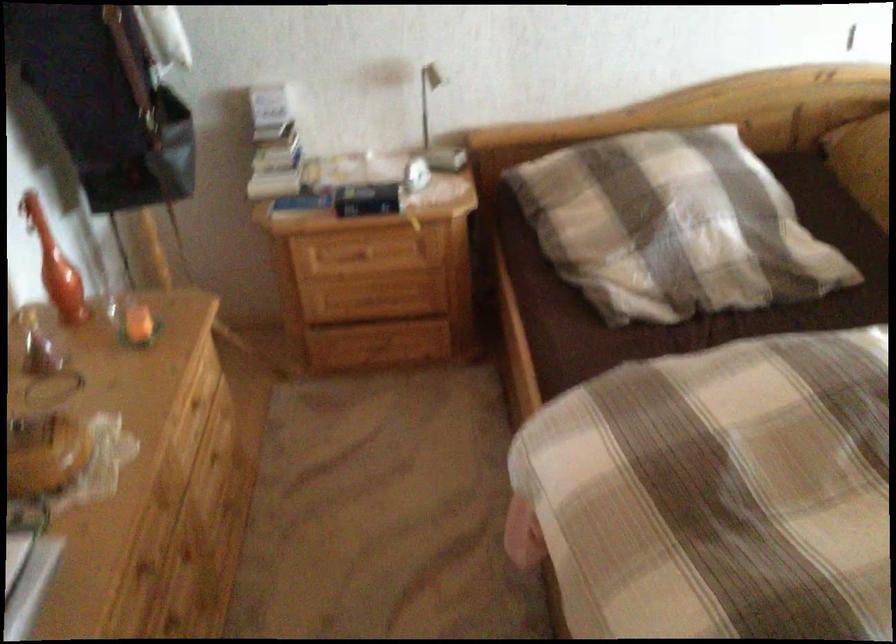
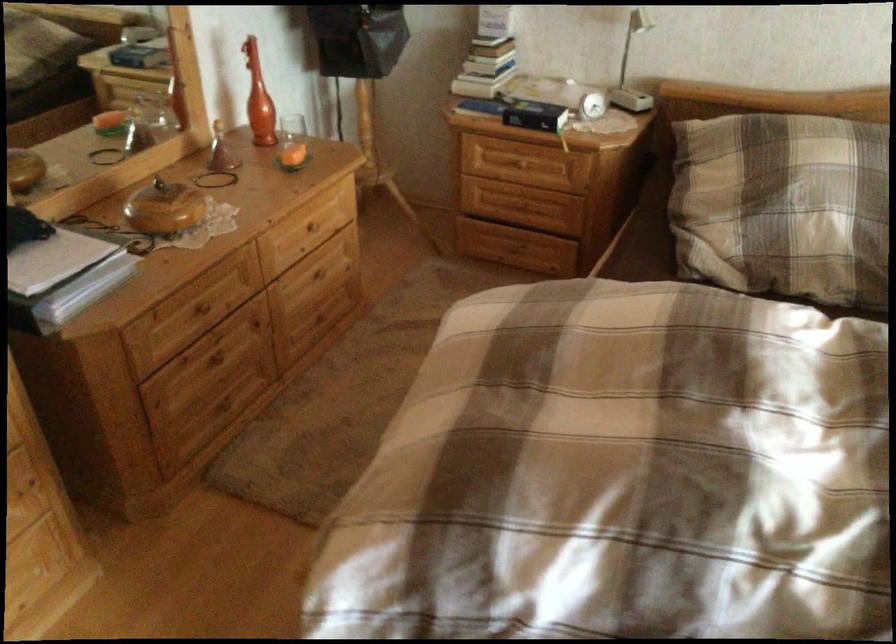
Question: In a continuous first-person perspective shot, in which direction is the camera moving?

Choices:
 (A) Left
 (B) Right
 (C) Forward
 (D) Backward

Answer: (B)